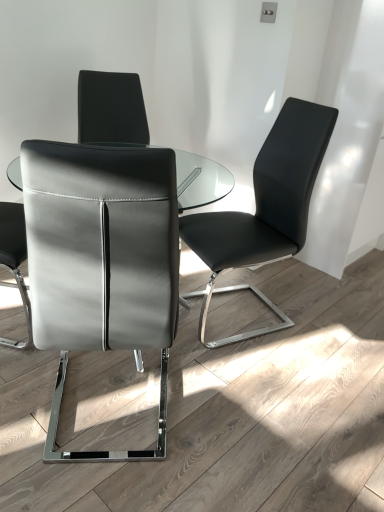
Locate an element on the screen. This screenshot has height=512, width=384. vacant space underneath black leather chair at center, the second chair positioned from the left (from a real-world perspective) is located at coordinates (245, 300).